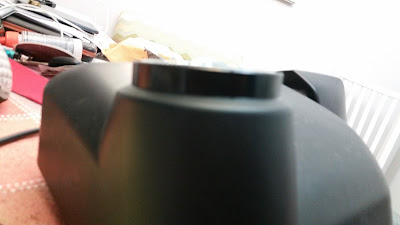
Locate an element on the screen. pillow is located at coordinates (150, 30).